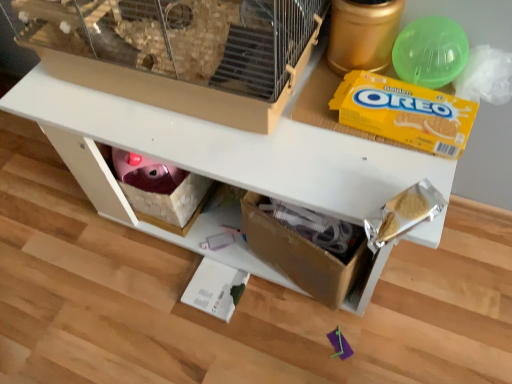
Measure the distance between white matte table at center and camera.

white matte table at center and camera are 23.89 inches apart.

Locate an element on the screen. beige plastic bird cage at upper center is located at coordinates (178, 51).

Considering the sizes of objects beige plastic bird cage at upper center and white matte table at center in the image provided, who is bigger, beige plastic bird cage at upper center or white matte table at center?

white matte table at center is bigger.

Is beige plastic bird cage at upper center placed right next to white matte table at center?

No.

Can you confirm if beige plastic bird cage at upper center is shorter than white matte table at center?

Indeed, beige plastic bird cage at upper center has a lesser height compared to white matte table at center.

Is beige plastic bird cage at upper center inside the boundaries of white matte table at center, or outside?

beige plastic bird cage at upper center is not enclosed by white matte table at center.

Is beige plastic bird cage at upper center far from green plastic ball at upper right?

Actually, beige plastic bird cage at upper center and green plastic ball at upper right are a little close together.

Is beige plastic bird cage at upper center facing towards green plastic ball at upper right?

No, beige plastic bird cage at upper center is not turned towards green plastic ball at upper right.

From a real-world perspective, is beige plastic bird cage at upper center physically below green plastic ball at upper right?

Actually, beige plastic bird cage at upper center is physically above green plastic ball at upper right in the real world.

Is green plastic ball at upper right next to yellow cardboard oreo at upper right?

green plastic ball at upper right and yellow cardboard oreo at upper right are clearly separated.

Is green plastic ball at upper right bigger than yellow cardboard oreo at upper right?

Correct, green plastic ball at upper right is larger in size than yellow cardboard oreo at upper right.

Considering the positions of objects green plastic ball at upper right and yellow cardboard oreo at upper right in the image provided, who is behind, green plastic ball at upper right or yellow cardboard oreo at upper right?

green plastic ball at upper right is further from the camera.

Consider the image. From a real-world perspective, is green plastic ball at upper right under yellow cardboard oreo at upper right?

Actually, green plastic ball at upper right is physically above yellow cardboard oreo at upper right in the real world.

Looking at this image, does white matte table at center appear on the right side of yellow cardboard oreo at upper right?

No.

In the scene shown: Considering the relative sizes of white matte table at center and yellow cardboard oreo at upper right in the image provided, is white matte table at center smaller than yellow cardboard oreo at upper right?

No.

Can you confirm if white matte table at center is taller than yellow cardboard oreo at upper right?

Yes, white matte table at center is taller than yellow cardboard oreo at upper right.

Based on the photo, measure the distance from white matte table at center to yellow cardboard oreo at upper right.

white matte table at center and yellow cardboard oreo at upper right are 10.15 inches apart.

Find the location of `cereal behind the beige plastic bird cage at upper center`. cereal behind the beige plastic bird cage at upper center is located at coordinates (405, 113).

Which is in front, point (414, 128) or point (211, 64)?

Positioned in front is point (414, 128).

Could beige plastic bird cage at upper center be considered to be inside yellow cardboard oreo at upper right?

No, yellow cardboard oreo at upper right does not contain beige plastic bird cage at upper center.

Would you say beige plastic bird cage at upper center is part of white matte table at center's contents?

Definitely not — beige plastic bird cage at upper center is not inside white matte table at center.

Considering the sizes of objects white matte table at center and beige plastic bird cage at upper center in the image provided, who is taller, white matte table at center or beige plastic bird cage at upper center?

With more height is white matte table at center.

Considering their positions, is white matte table at center located in front of or behind beige plastic bird cage at upper center?

Clearly, white matte table at center is behind beige plastic bird cage at upper center.

Is point (90, 115) closer or farther from the camera than point (112, 64)?

Clearly, point (90, 115) is more distant from the camera than point (112, 64).

Can you confirm if beige plastic bird cage at upper center is taller than yellow cardboard oreo at upper right?

Yes, beige plastic bird cage at upper center is taller than yellow cardboard oreo at upper right.

What's the angular difference between beige plastic bird cage at upper center and yellow cardboard oreo at upper right's facing directions?

There is a 3.03e-05-degree angle between the facing directions of beige plastic bird cage at upper center and yellow cardboard oreo at upper right.

From the picture: Does beige plastic bird cage at upper center turn towards yellow cardboard oreo at upper right?

No, beige plastic bird cage at upper center is not turned towards yellow cardboard oreo at upper right.

Would you say beige plastic bird cage at upper center contains yellow cardboard oreo at upper right?

No, yellow cardboard oreo at upper right is not surrounded by beige plastic bird cage at upper center.

Identify the location of table directly beneath the beige plastic bird cage at upper center (from a real-world perspective). The height and width of the screenshot is (384, 512). (221, 159).

In the image, there is a green plastic ball at upper right. Where is `bird cage above it (from the image's perspective)`? bird cage above it (from the image's perspective) is located at coordinates (178, 51).

Based on their spatial positions, is white matte table at center or beige plastic bird cage at upper center further from green plastic ball at upper right?

white matte table at center is positioned further to the anchor green plastic ball at upper right.

Considering their positions, is beige plastic bird cage at upper center positioned further to yellow cardboard oreo at upper right than white matte table at center?

beige plastic bird cage at upper center.

Estimate the real-world distances between objects in this image. Which object is closer to beige plastic bird cage at upper center, white matte table at center or green plastic ball at upper right?

Based on the image, white matte table at center appears to be nearer to beige plastic bird cage at upper center.

From the image, which object appears to be farther from white matte table at center, yellow cardboard oreo at upper right or green plastic ball at upper right?

green plastic ball at upper right is positioned further to the anchor white matte table at center.

Considering their positions, is yellow cardboard oreo at upper right positioned closer to beige plastic bird cage at upper center than green plastic ball at upper right?

Among the two, yellow cardboard oreo at upper right is located nearer to beige plastic bird cage at upper center.

From the picture: From the image, which object appears to be farther from white matte table at center, beige plastic bird cage at upper center or yellow cardboard oreo at upper right?

The object further to white matte table at center is yellow cardboard oreo at upper right.

Estimate the real-world distances between objects in this image. Which object is further from green plastic ball at upper right, yellow cardboard oreo at upper right or white matte table at center?

white matte table at center lies further to green plastic ball at upper right than the other object.

In the scene shown: Estimate the real-world distances between objects in this image. Which object is further from beige plastic bird cage at upper center, green plastic ball at upper right or white matte table at center?

green plastic ball at upper right is further to beige plastic bird cage at upper center.

You are a GUI agent. You are given a task and a screenshot of the screen. Output one action in this format:
    pyautogui.click(x=<x>, y=<y>)
    Task: Click on the cereal between beige plastic bird cage at upper center and green plastic ball at upper right
    
    Given the screenshot: What is the action you would take?
    pyautogui.click(x=405, y=113)

Where is `table between beige plastic bird cage at upper center and yellow cardboard oreo at upper right in the horizontal direction`? Image resolution: width=512 pixels, height=384 pixels. table between beige plastic bird cage at upper center and yellow cardboard oreo at upper right in the horizontal direction is located at coordinates (221, 159).

Find the location of a particular element. cereal situated between white matte table at center and green plastic ball at upper right from left to right is located at coordinates (405, 113).

This screenshot has width=512, height=384. Find the location of `table situated between beige plastic bird cage at upper center and green plastic ball at upper right from left to right`. table situated between beige plastic bird cage at upper center and green plastic ball at upper right from left to right is located at coordinates (221, 159).